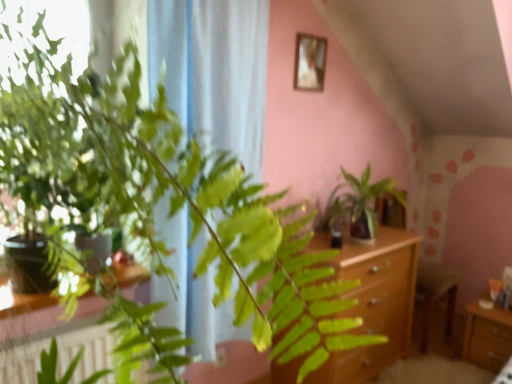
You are a GUI agent. You are given a task and a screenshot of the screen. Output one action in this format:
    pyautogui.click(x=<x>, y=<y>)
    Task: Click on the white sheer curtain at left
    The width and height of the screenshot is (512, 384).
    Given the screenshot: What is the action you would take?
    pyautogui.click(x=214, y=70)

The width and height of the screenshot is (512, 384). Identify the location of wooden drawer at lower right. (487, 337).

This screenshot has height=384, width=512. Describe the element at coordinates (375, 304) in the screenshot. I see `light brown wooden dresser at center` at that location.

What do you see at coordinates (310, 62) in the screenshot?
I see `wooden frame at upper center` at bounding box center [310, 62].

The height and width of the screenshot is (384, 512). Find the location of `green glossy plant at center`. green glossy plant at center is located at coordinates (359, 204).

The height and width of the screenshot is (384, 512). Identify the location of white sheer curtain at left. (214, 70).

From the image's perspective, is wooden frame at upper center located above or below green glossy plant at center?

Clearly, from the image's perspective, wooden frame at upper center is above green glossy plant at center.

Is wooden frame at upper center facing towards green glossy plant at center?

No, wooden frame at upper center is not facing towards green glossy plant at center.

Considering the positions of objects wooden frame at upper center and green glossy plant at center in the image provided, who is more to the right, wooden frame at upper center or green glossy plant at center?

green glossy plant at center is more to the right.

Based on their sizes in the image, would you say wooden frame at upper center is bigger or smaller than green glossy plant at center?

In the image, wooden frame at upper center appears to be smaller than green glossy plant at center.

In the image, is green glossy plant at center on the left side or the right side of wooden drawer at lower right?

green glossy plant at center is to the left of wooden drawer at lower right.

Consider the image. Which is closer, (358, 238) or (500, 339)?

Point (358, 238) appears to be closer to the viewer than point (500, 339).

Is wooden drawer at lower right completely or partially inside green glossy plant at center?

That's incorrect, wooden drawer at lower right is not inside green glossy plant at center.

Find the location of a particular element. curtain above the light brown wooden dresser at center (from the image's perspective) is located at coordinates (214, 70).

Is point (223, 74) closer to camera compared to point (321, 366)?

That is True.

Is light brown wooden dresser at center located within white sheer curtain at left?

Definitely not — light brown wooden dresser at center is not inside white sheer curtain at left.

Who is bigger, white sheer curtain at left or light brown wooden dresser at center?

With larger size is light brown wooden dresser at center.

Is light brown wooden dresser at center wider or thinner than green glossy plant at center?

Clearly, light brown wooden dresser at center has less width compared to green glossy plant at center.

Can you confirm if light brown wooden dresser at center is shorter than green glossy plant at center?

No.

How different are the orientations of light brown wooden dresser at center and green glossy plant at center in degrees?

There is a 0.184-degree angle between the facing directions of light brown wooden dresser at center and green glossy plant at center.

Would you consider light brown wooden dresser at center to be distant from green glossy plant at center?

Actually, light brown wooden dresser at center and green glossy plant at center are a little close together.

Is green glossy plant at center positioned in front of light brown wooden dresser at center?

That is True.

Would you consider green glossy plant at center to be distant from light brown wooden dresser at center?

No.

Does green glossy plant at center turn towards light brown wooden dresser at center?

No, green glossy plant at center is not aimed at light brown wooden dresser at center.

This screenshot has height=384, width=512. Find the location of `picture frame located behind the green glossy plant at center`. picture frame located behind the green glossy plant at center is located at coordinates pyautogui.click(x=310, y=62).

From a real-world perspective, which object stands above the other?

From a 3D spatial view, wooden frame at upper center is above.

Measure the distance between green glossy plant at center and wooden frame at upper center.

A distance of 25.09 inches exists between green glossy plant at center and wooden frame at upper center.

Would you say green glossy plant at center is outside wooden frame at upper center?

That's correct, green glossy plant at center is outside of wooden frame at upper center.

Considering the sizes of wooden frame at upper center and light brown wooden dresser at center in the image, is wooden frame at upper center taller or shorter than light brown wooden dresser at center?

Clearly, wooden frame at upper center is shorter compared to light brown wooden dresser at center.

The image size is (512, 384). In order to click on vanity below the wooden frame at upper center (from the image's perspective) in this screenshot , I will do `click(375, 304)`.

Considering the relative positions of wooden frame at upper center and light brown wooden dresser at center in the image provided, is wooden frame at upper center to the left of light brown wooden dresser at center from the viewer's perspective?

Yes, wooden frame at upper center is to the left of light brown wooden dresser at center.

In the image, there is a wooden frame at upper center. In order to click on houseplant below it (from a real-world perspective) in this screenshot , I will do `click(359, 204)`.

Locate an element on the screen. The image size is (512, 384). table on the right of green glossy plant at center is located at coordinates (487, 337).

From the image, which object appears to be farther from light brown wooden dresser at center, wooden drawer at lower right or white sheer curtain at left?

white sheer curtain at left.

Estimate the real-world distances between objects in this image. Which object is further from wooden frame at upper center, green glossy plant at center or light brown wooden dresser at center?

light brown wooden dresser at center lies further to wooden frame at upper center than the other object.

Based on their spatial positions, is wooden frame at upper center or light brown wooden dresser at center closer to white sheer curtain at left?

wooden frame at upper center is positioned closer to the anchor white sheer curtain at left.

Considering their positions, is green glossy plant at center positioned closer to wooden drawer at lower right than white sheer curtain at left?

Based on the image, green glossy plant at center appears to be nearer to wooden drawer at lower right.

Looking at the image, which one is located further to white sheer curtain at left, wooden frame at upper center or wooden drawer at lower right?

wooden drawer at lower right is positioned further to the anchor white sheer curtain at left.

Which object lies further to the anchor point green glossy plant at center, white sheer curtain at left or light brown wooden dresser at center?

The object further to green glossy plant at center is white sheer curtain at left.

In the scene shown: When comparing their distances from light brown wooden dresser at center, does wooden drawer at lower right or green glossy plant at center seem further?

Based on the image, wooden drawer at lower right appears to be further to light brown wooden dresser at center.

From the image, which object appears to be farther from white sheer curtain at left, green glossy plant at center or wooden drawer at lower right?

wooden drawer at lower right.

This screenshot has height=384, width=512. What are the coordinates of `curtain that lies between wooden frame at upper center and light brown wooden dresser at center from top to bottom` in the screenshot? It's located at (214, 70).

Locate an element on the screen. The height and width of the screenshot is (384, 512). houseplant between white sheer curtain at left and wooden frame at upper center from front to back is located at coordinates (359, 204).

Locate an element on the screen. houseplant between wooden frame at upper center and light brown wooden dresser at center in the up-down direction is located at coordinates (359, 204).

Locate an element on the screen. picture frame between white sheer curtain at left and wooden drawer at lower right in the horizontal direction is located at coordinates (310, 62).